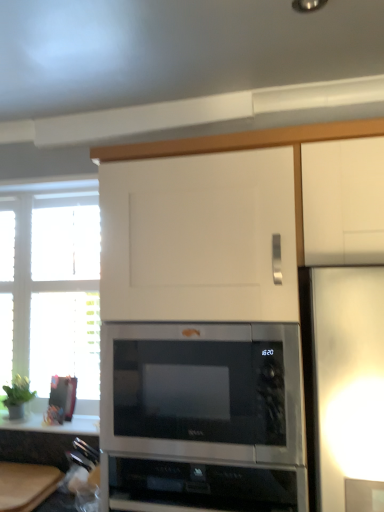
Question: Is white glossy countertop at lower left wider or thinner than wooden cutting board at lower left?

Choices:
 (A) wide
 (B) thin

Answer: (B)

Question: From the image's perspective, relative to wooden cutting board at lower left, is white glossy countertop at lower left above or below?

Choices:
 (A) below
 (B) above

Answer: (B)

Question: Which of these objects is positioned closest to the white wooden window at left?

Choices:
 (A) black glass cooktop at lower center
 (B) wooden cutting board at lower left
 (C) stainless steel microwave at center
 (D) white glossy countertop at lower left

Answer: (D)

Question: Which of these objects is positioned farthest from the stainless steel microwave at center?

Choices:
 (A) white wooden window at left
 (B) wooden cutting board at lower left
 (C) white glossy countertop at lower left
 (D) black glass cooktop at lower center

Answer: (A)